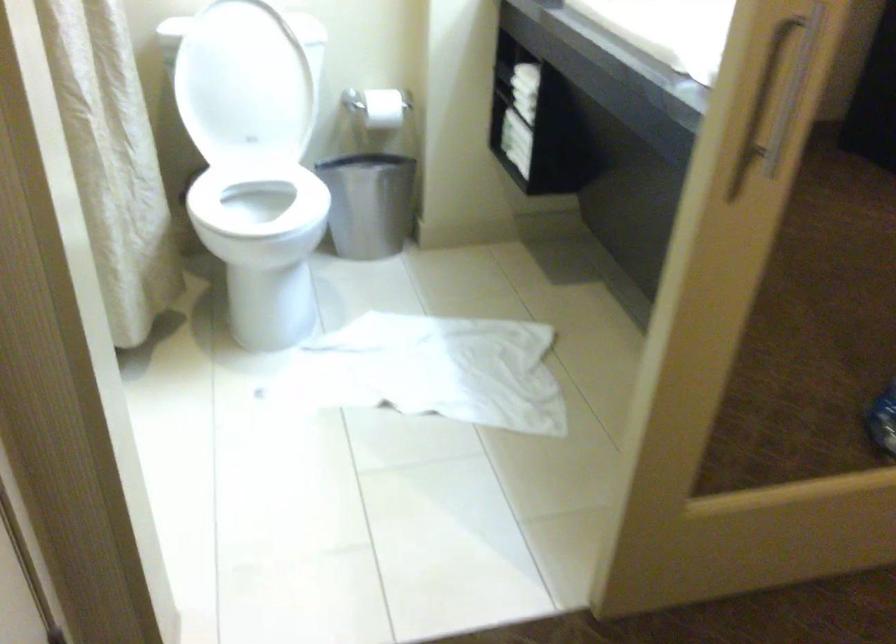
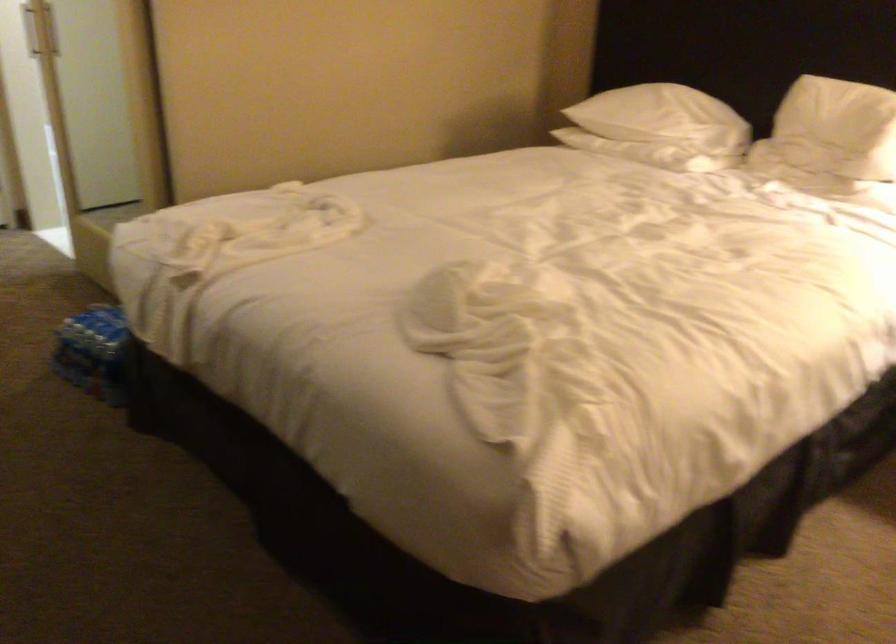
Question: I am providing you with two images of the same scene from different viewpoints. Please identify which objects are invisible in image2.

Choices:
 (A) plastic water bottle
 (B) silver trash can
 (C) door handle
 (D) white earbud

Answer: (B)